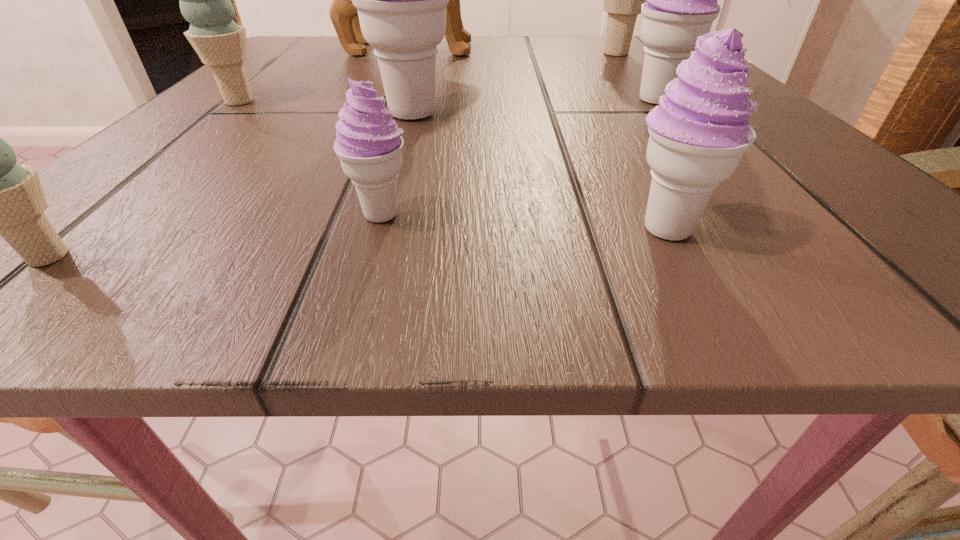
Where is `vacant space located 0.150m at the face of the puppy`? vacant space located 0.150m at the face of the puppy is located at coordinates (583, 49).

Where is `free spot located on the back of the second tallest object`? This screenshot has width=960, height=540. free spot located on the back of the second tallest object is located at coordinates (422, 78).

I want to click on vacant space located 0.280m on the front of the farthest ice cream, so click(x=671, y=119).

This screenshot has height=540, width=960. I want to click on vacant area situated on the left of the second biggest purple icecream, so click(x=427, y=101).

The image size is (960, 540). I want to click on free space located 0.090m on the back of the second nearest blue ice cream, so pos(270,75).

Image resolution: width=960 pixels, height=540 pixels. Find the location of `vacant space situated on the back of the third biggest purple icecream`. vacant space situated on the back of the third biggest purple icecream is located at coordinates (582, 77).

At what (x,y) coordinates should I click in order to perform the action: click on blank area located on the left of the smallest purple icecream. Please return your answer as a coordinate pair (x, y). Looking at the image, I should click on (288, 214).

The height and width of the screenshot is (540, 960). I want to click on puppy that is at the far edge, so click(344, 15).

You are a GUI agent. You are given a task and a screenshot of the screen. Output one action in this format:
    pyautogui.click(x=<x>, y=<y>)
    Task: Click on the ice cream located at the far edge
    Image resolution: width=960 pixels, height=540 pixels.
    Given the screenshot: What is the action you would take?
    pyautogui.click(x=622, y=0)

Identify the location of puppy that is at the left edge. The height and width of the screenshot is (540, 960). (344, 15).